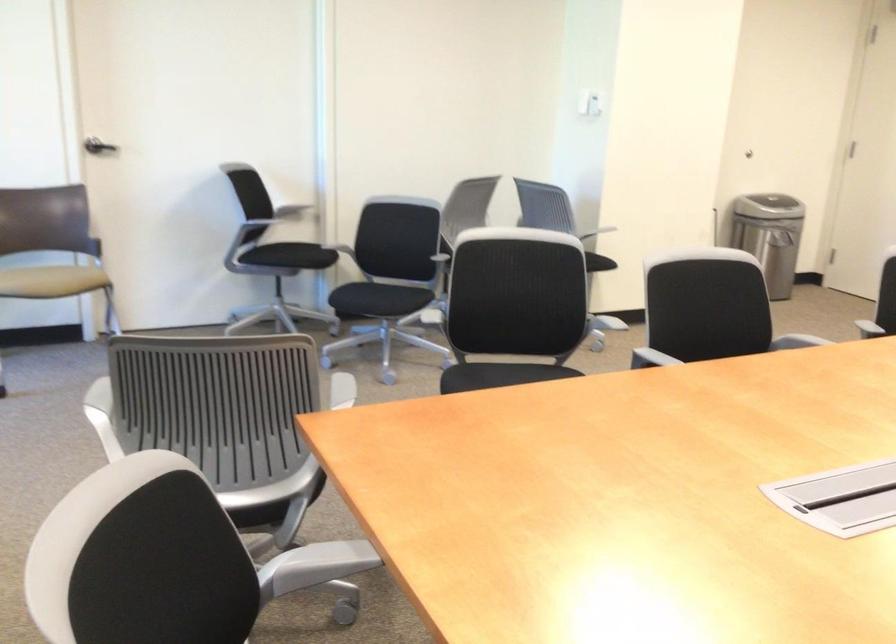
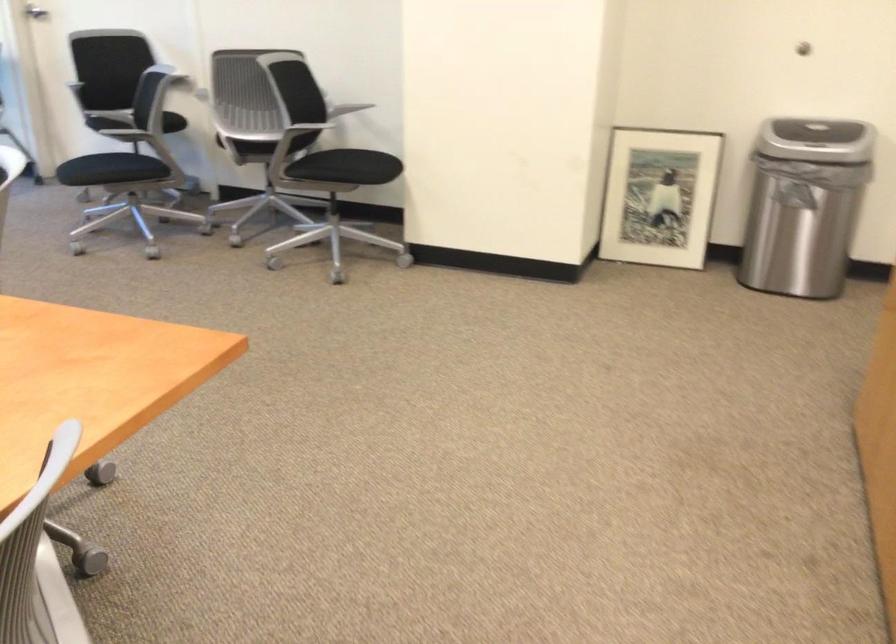
Question: I am providing you with two images of the same scene from different viewpoints. After the viewpoint changes to image2, which objects are now occluded?

Choices:
 (A) beige chair sitting surface
 (B) black ottoman
 (C) trash can lid
 (D) chair sitting surface

Answer: (A)